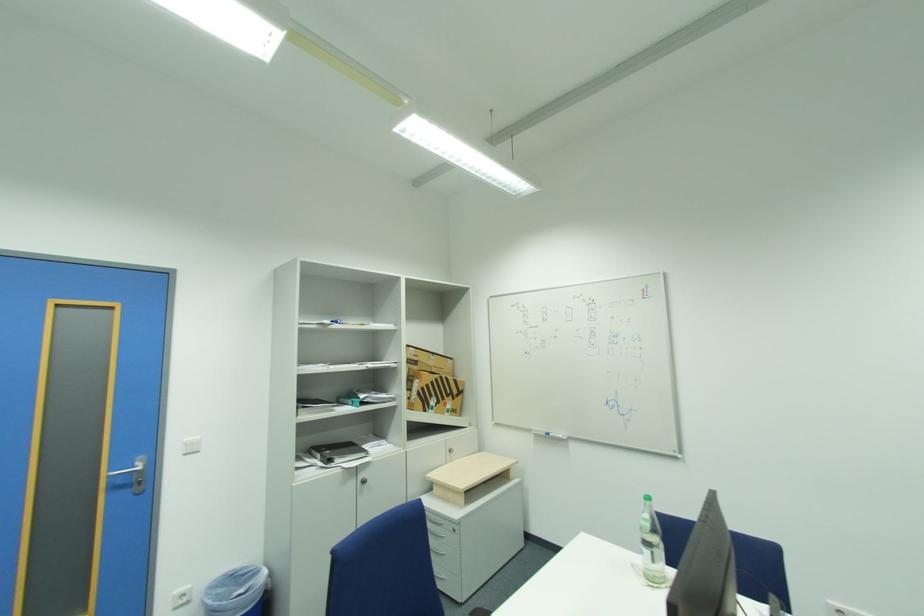
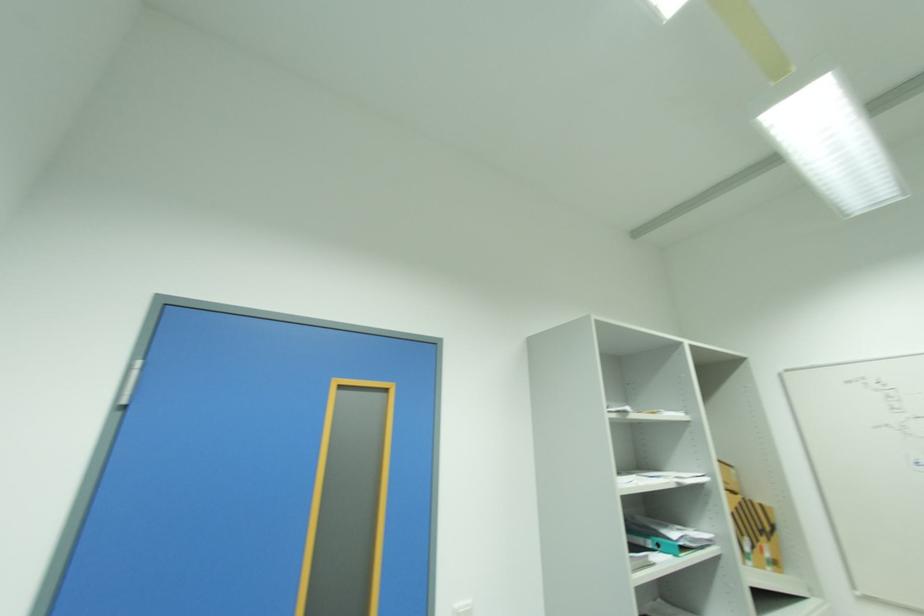
The point at (x=191, y=440) is marked in the first image. Where is the corresponding point in the second image?

(463, 604)